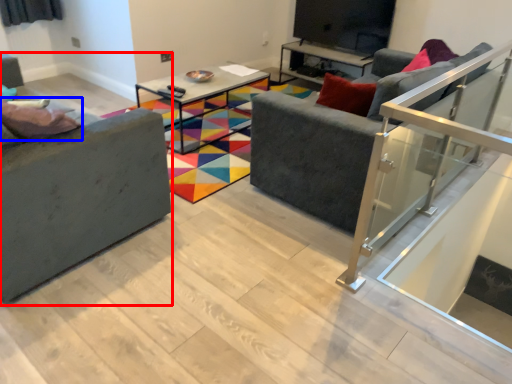
Question: Which of the following is the closest to the observer, studio couch (highlighted by a red box) or pillow (highlighted by a blue box)?

Choices:
 (A) studio couch
 (B) pillow

Answer: (A)